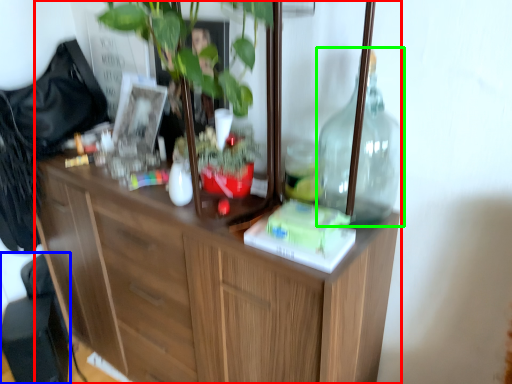
Question: Which object is the farthest from cabinetry (highlighted by a red box)? Choose among these: swivel chair (highlighted by a blue box) or bottle (highlighted by a green box).

Choices:
 (A) swivel chair
 (B) bottle

Answer: (A)